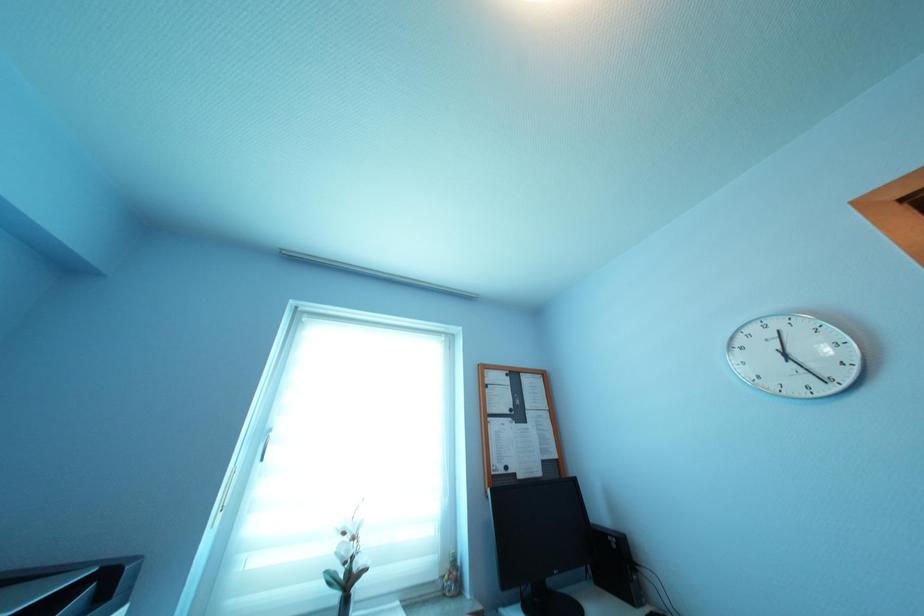
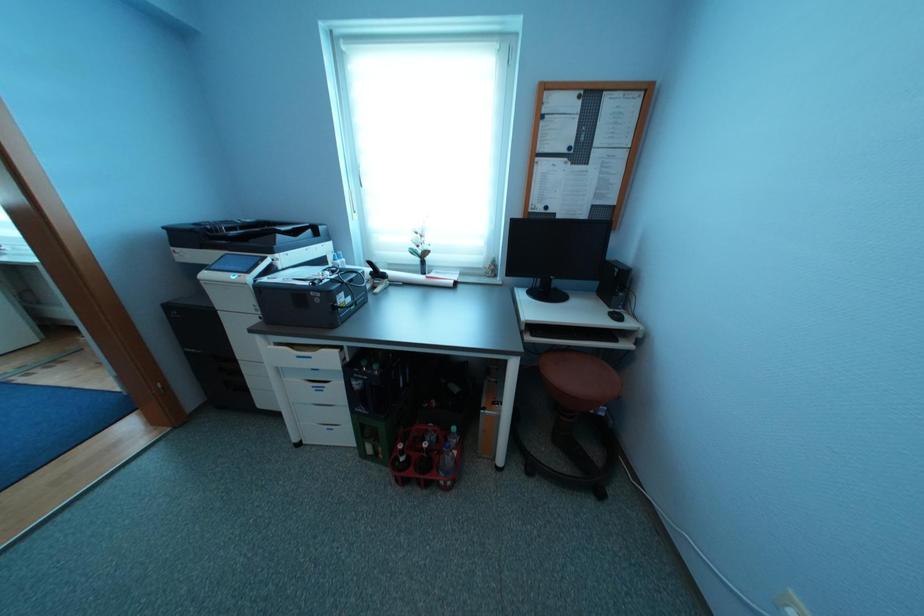
How did the camera likely rotate?

The camera rotated toward left-down.